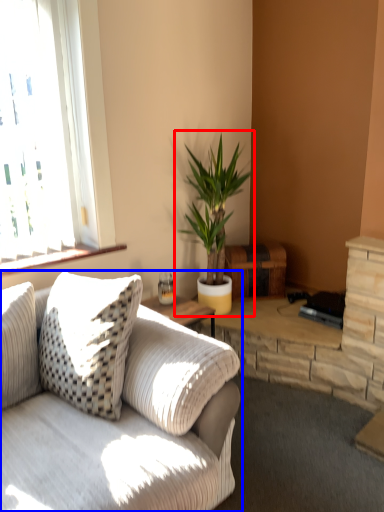
Question: Which object appears farthest to the camera in this image, houseplant (highlighted by a red box) or studio couch (highlighted by a blue box)?

Choices:
 (A) houseplant
 (B) studio couch

Answer: (A)